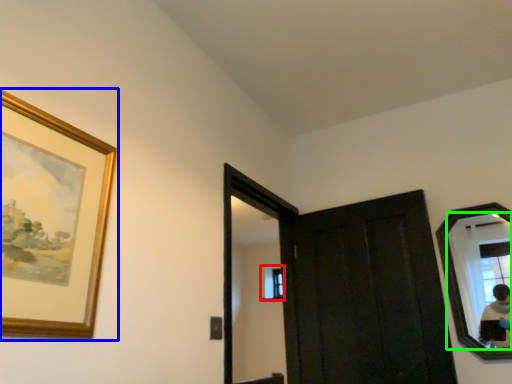
Question: Estimate the real-world distances between objects in this image. Which object is closer to window (highlighted by a red box), picture frame (highlighted by a blue box) or mirror (highlighted by a green box)?

Choices:
 (A) picture frame
 (B) mirror

Answer: (B)